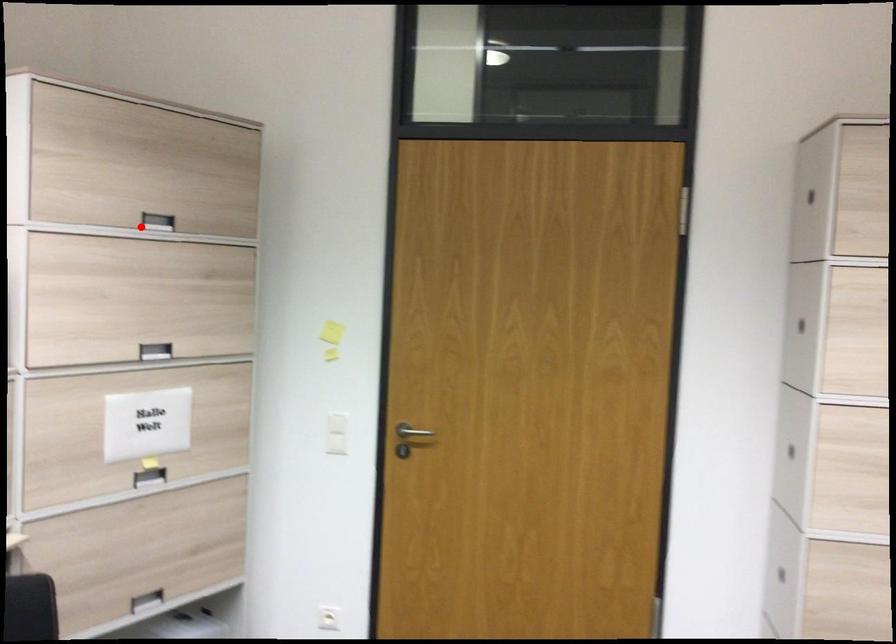
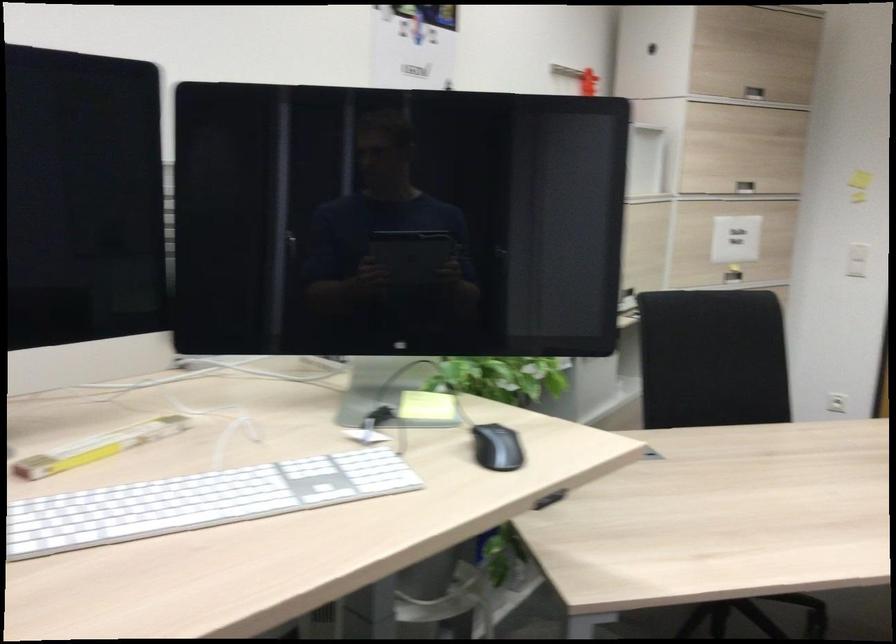
Where in the second image is the point corresponding to the highlighted location from the first image?

(754, 93)